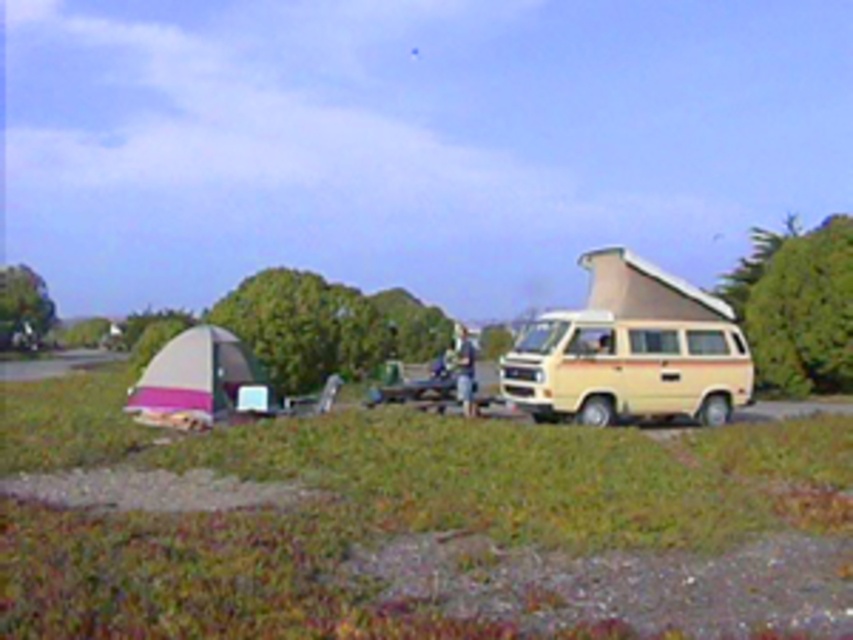
Question: Which object appears closest to the camera in this image?

Choices:
 (A) green grass at center
 (B) light blue denim jeans at center

Answer: (A)

Question: Is beige/woodgrain van at right to the left of light blue denim jeans at center from the viewer's perspective?

Choices:
 (A) yes
 (B) no

Answer: (B)

Question: Which point is farther to the camera?

Choices:
 (A) (628, 353)
 (B) (141, 413)
 (C) (341, 442)
 (D) (473, 365)

Answer: (D)

Question: Is green grass at center to the left of beige/woodgrain van at right from the viewer's perspective?

Choices:
 (A) yes
 (B) no

Answer: (A)

Question: Is the position of green grass at center more distant than that of beige/woodgrain van at right?

Choices:
 (A) no
 (B) yes

Answer: (A)

Question: Which of the following is the closest to the observer?

Choices:
 (A) (132, 385)
 (B) (473, 346)
 (C) (288, 516)
 (D) (666, 404)

Answer: (C)